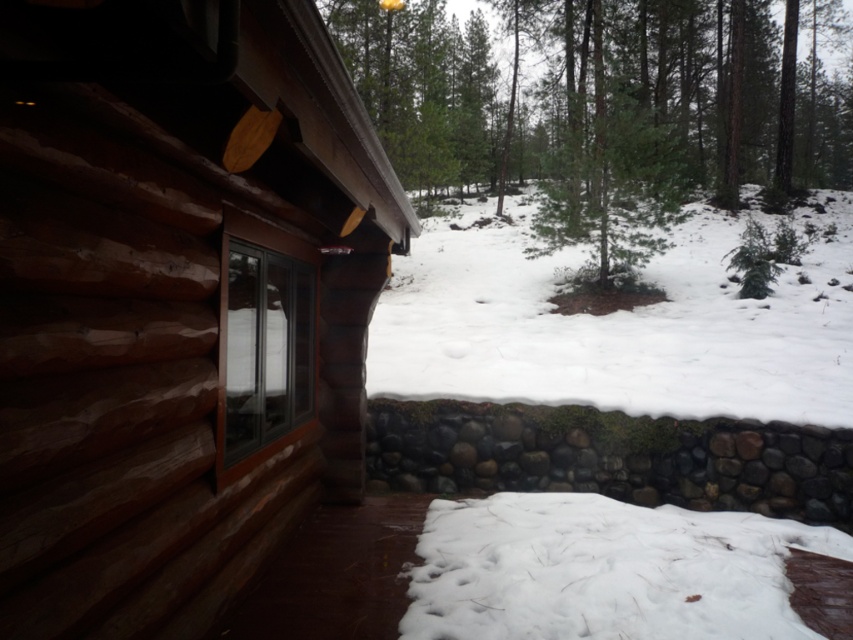
Question: Does green textured pine tree at center have a lesser width compared to white fluffy snow at lower center?

Choices:
 (A) no
 (B) yes

Answer: (A)

Question: Estimate the real-world distances between objects in this image. Which object is farther from the white fluffy snow at lower center?

Choices:
 (A) clear glass window at center
 (B) white fluffy snow at center

Answer: (B)

Question: Which point is farther to the camera?

Choices:
 (A) (578, 365)
 (B) (224, 369)

Answer: (A)

Question: Among these objects, which one is nearest to the camera?

Choices:
 (A) white fluffy snow at lower center
 (B) white fluffy snow at center
 (C) green textured pine tree at center
 (D) clear glass window at center

Answer: (A)

Question: Is the position of brown wooden cabin at left more distant than that of green textured pine tree at center?

Choices:
 (A) no
 (B) yes

Answer: (A)

Question: Does green textured pine tree at center have a lesser width compared to white fluffy snow at center?

Choices:
 (A) no
 (B) yes

Answer: (A)